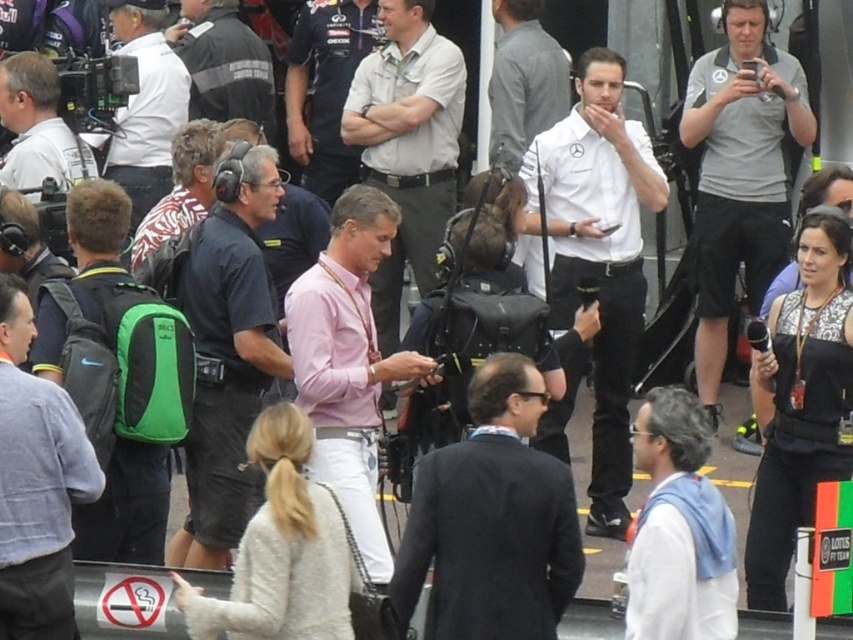
Question: Is gray matte shirt at center wider than white matte jacket at upper left?

Choices:
 (A) no
 (B) yes

Answer: (A)

Question: Which point is farther from the camera taking this photo?

Choices:
 (A) (599, 99)
 (B) (32, 112)

Answer: (B)

Question: Which point is closer to the camera?

Choices:
 (A) (374, 3)
 (B) (42, 138)
 (C) (247, 266)

Answer: (C)

Question: Which object appears closest to the camera in this image?

Choices:
 (A) gray matte shirt at center
 (B) matte black camera at left
 (C) gray shirt at center
 (D) white matte shirt at center

Answer: (D)

Question: Is white matte shirt at center thinner than white matte jacket at upper left?

Choices:
 (A) no
 (B) yes

Answer: (A)

Question: In this image, where is dark gray jacket at center located relative to matte black camera at left?

Choices:
 (A) right
 (B) left

Answer: (A)